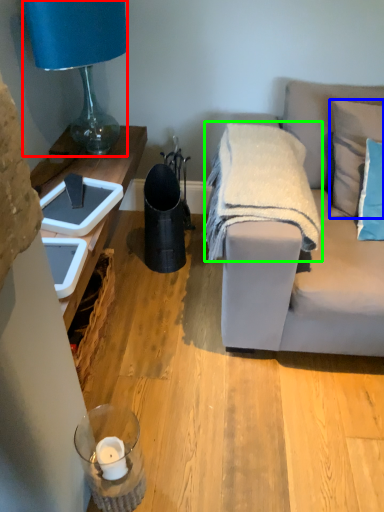
Question: Considering the real-world distances, which object is farthest from lamp (highlighted by a red box)? pillow (highlighted by a blue box) or blanket (highlighted by a green box)?

Choices:
 (A) pillow
 (B) blanket

Answer: (A)